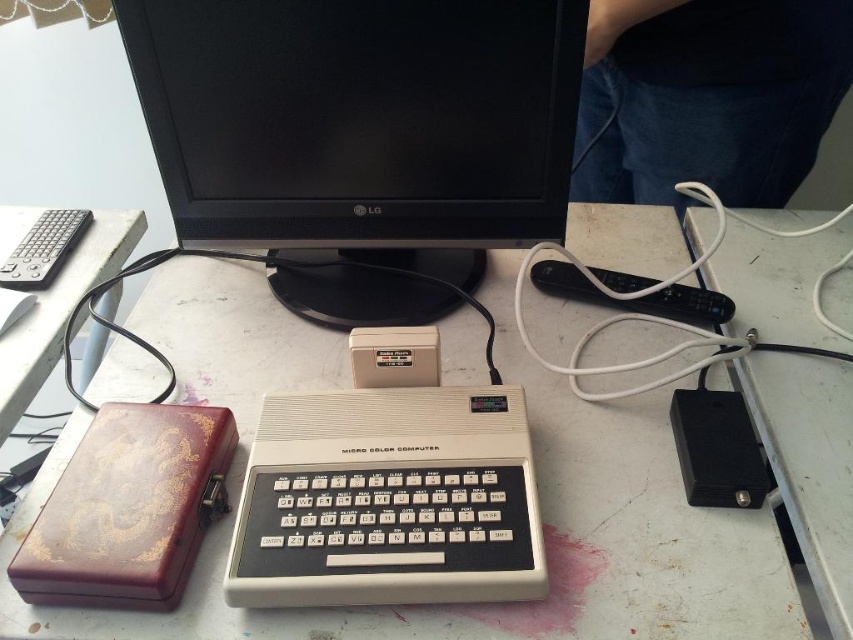
Question: Which is nearer to the wooden at left?

Choices:
 (A) white plastic computer desk at center
 (B) black plastic power supply at right
 (C) matte black monitor at center

Answer: (C)

Question: Where is white plastic computer desk at center located in relation to black plastic power supply at right in the image?

Choices:
 (A) left
 (B) right

Answer: (A)

Question: Which point is closer to the camera?

Choices:
 (A) (788, 250)
 (B) (413, 609)

Answer: (B)

Question: Can you confirm if white plastic computer desk at center is wider than black plastic power supply at right?

Choices:
 (A) yes
 (B) no

Answer: (A)

Question: Which of the following is the farthest from the observer?

Choices:
 (A) white plastic computer desk at center
 (B) wooden at left
 (C) matte black monitor at center
 (D) black plastic power supply at right

Answer: (B)

Question: Is white plastic computer desk at center thinner than black plastic power supply at right?

Choices:
 (A) yes
 (B) no

Answer: (B)